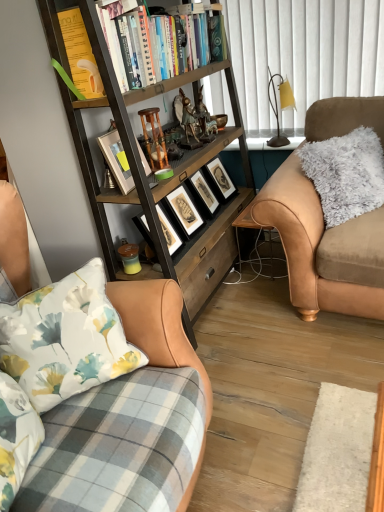
Question: Considering the relative sizes of brown leather couch at left, positioned as the first studio couch in left-to-right order, and wooden bookcase at left in the image provided, is brown leather couch at left, positioned as the first studio couch in left-to-right order, bigger than wooden bookcase at left?

Choices:
 (A) no
 (B) yes

Answer: (A)

Question: From a real-world perspective, is brown leather couch at left, marked as the 2th studio couch in a back-to-front arrangement, positioned under wooden bookcase at left based on gravity?

Choices:
 (A) no
 (B) yes

Answer: (B)

Question: Does brown leather couch at left, marked as the 2th studio couch in a back-to-front arrangement, appear on the left side of wooden bookcase at left?

Choices:
 (A) yes
 (B) no

Answer: (A)

Question: Is brown leather couch at left, which is the first studio couch in front-to-back order, turned away from wooden bookcase at left?

Choices:
 (A) no
 (B) yes

Answer: (A)

Question: Is brown leather couch at left, which is the first studio couch in front-to-back order, wider than wooden bookcase at left?

Choices:
 (A) no
 (B) yes

Answer: (B)

Question: In the image, is hardcover books at upper center on the left side or the right side of black matte picture frame at center, which ranks as the first picture frame in right-to-left order?

Choices:
 (A) right
 (B) left

Answer: (B)

Question: In terms of width, does hardcover books at upper center look wider or thinner when compared to black matte picture frame at center, which appears as the second picture frame when viewed from the left?

Choices:
 (A) thin
 (B) wide

Answer: (B)

Question: Based on their sizes in the image, would you say hardcover books at upper center is bigger or smaller than black matte picture frame at center, which ranks as the first picture frame in right-to-left order?

Choices:
 (A) small
 (B) big

Answer: (B)

Question: From the image's perspective, is hardcover books at upper center above or below black matte picture frame at center, which ranks as the first picture frame in right-to-left order?

Choices:
 (A) above
 (B) below

Answer: (A)

Question: Considering the positions of wooden bookcase at left and fuzzy beige couch at right, the second studio couch viewed from the front, in the image, is wooden bookcase at left bigger or smaller than fuzzy beige couch at right, the second studio couch viewed from the front,?

Choices:
 (A) big
 (B) small

Answer: (A)

Question: Does point (119, 106) appear closer or farther from the camera than point (365, 283)?

Choices:
 (A) closer
 (B) farther

Answer: (A)

Question: From the image's perspective, relative to fuzzy beige couch at right, the first studio couch from the back, is wooden bookcase at left above or below?

Choices:
 (A) above
 (B) below

Answer: (A)

Question: Considering the positions of wooden bookcase at left and fuzzy beige couch at right, the first studio couch positioned from the right, in the image, is wooden bookcase at left taller or shorter than fuzzy beige couch at right, the first studio couch positioned from the right,?

Choices:
 (A) tall
 (B) short

Answer: (A)

Question: Is fuzzy beige couch at right, the first studio couch positioned from the right, situated inside white textured curtain at upper center or outside?

Choices:
 (A) outside
 (B) inside

Answer: (A)

Question: Looking at the image, does fuzzy beige couch at right, the first studio couch from the back, seem bigger or smaller compared to white textured curtain at upper center?

Choices:
 (A) big
 (B) small

Answer: (A)